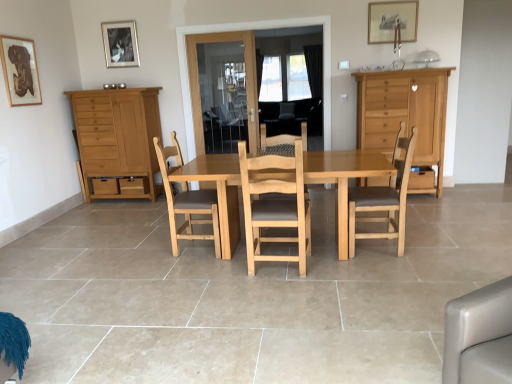
Question: Considering the relative positions of wooden picture frame at upper center, which ranks as the first picture frame in right-to-left order, and wooden drawer at right in the image provided, is wooden picture frame at upper center, which ranks as the first picture frame in right-to-left order, to the right of wooden drawer at right from the viewer's perspective?

Choices:
 (A) yes
 (B) no

Answer: (B)

Question: Considering the relative positions of wooden picture frame at upper center, which is the 3th picture frame in left-to-right order, and wooden drawer at right in the image provided, is wooden picture frame at upper center, which is the 3th picture frame in left-to-right order, to the left of wooden drawer at right from the viewer's perspective?

Choices:
 (A) no
 (B) yes

Answer: (B)

Question: Considering the relative positions of wooden picture frame at upper center, which is the 3th picture frame in left-to-right order, and wooden drawer at right in the image provided, is wooden picture frame at upper center, which is the 3th picture frame in left-to-right order, in front of wooden drawer at right?

Choices:
 (A) no
 (B) yes

Answer: (A)

Question: Is wooden picture frame at upper center, which ranks as the first picture frame in right-to-left order, taller than wooden drawer at right?

Choices:
 (A) no
 (B) yes

Answer: (B)

Question: Is wooden picture frame at upper center, which ranks as the first picture frame in right-to-left order, aimed at wooden drawer at right?

Choices:
 (A) yes
 (B) no

Answer: (B)

Question: In terms of height, does light brown wood chair at center, the 1th chair from the right, look taller or shorter compared to light brown wood chair at center, acting as the 3th chair starting from the right?

Choices:
 (A) short
 (B) tall

Answer: (A)

Question: Considering the positions of light brown wood chair at center, the 1th chair from the right, and light brown wood chair at center, acting as the 3th chair starting from the right, in the image, is light brown wood chair at center, the 1th chair from the right, wider or thinner than light brown wood chair at center, acting as the 3th chair starting from the right,?

Choices:
 (A) thin
 (B) wide

Answer: (B)

Question: Does point (362, 220) appear closer or farther from the camera than point (190, 213)?

Choices:
 (A) farther
 (B) closer

Answer: (A)

Question: Is light brown wood chair at center, the 1th chair from the right, situated inside light brown wood chair at center, which is the first chair in left-to-right order, or outside?

Choices:
 (A) outside
 (B) inside

Answer: (A)

Question: From the image's perspective, relative to transparent glass door at center, the 1th glass door in the right-to-left sequence, is light brown wood chair at center, which is the first chair in left-to-right order, above or below?

Choices:
 (A) below
 (B) above

Answer: (A)

Question: Which is correct: light brown wood chair at center, which is the first chair in left-to-right order, is inside transparent glass door at center, the 1th glass door in the right-to-left sequence, or outside of it?

Choices:
 (A) outside
 (B) inside

Answer: (A)

Question: Is light brown wood chair at center, which is the first chair in left-to-right order, taller or shorter than transparent glass door at center, the second glass door in the left-to-right sequence?

Choices:
 (A) short
 (B) tall

Answer: (A)

Question: Is light brown wood chair at center, which is the first chair in left-to-right order, to the left or to the right of transparent glass door at center, the second glass door in the left-to-right sequence, in the image?

Choices:
 (A) left
 (B) right

Answer: (A)

Question: Is light brown wood chair at center, acting as the 3th chair starting from the right, inside the boundaries of wooden picture frame at upper center, which ranks as the first picture frame in right-to-left order, or outside?

Choices:
 (A) outside
 (B) inside

Answer: (A)

Question: From a real-world perspective, relative to wooden picture frame at upper center, positioned as the second picture frame in back-to-front order, is light brown wood chair at center, acting as the 3th chair starting from the right, vertically above or below?

Choices:
 (A) above
 (B) below

Answer: (B)